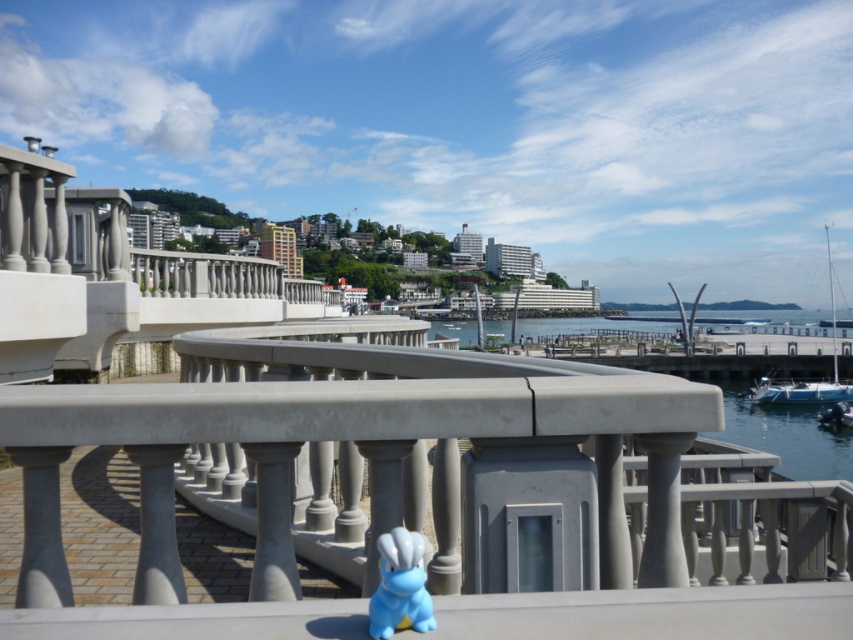
Question: Which object is the closest to the clear water at center?

Choices:
 (A) blue rubber duck at center
 (B) white glossy boat at right
 (C) blue plastic boat at lower right

Answer: (A)

Question: Is clear water at center closer to camera compared to blue rubber duck at center?

Choices:
 (A) yes
 (B) no

Answer: (B)

Question: Which of the following is the farthest from the observer?

Choices:
 (A) (492, 324)
 (B) (834, 387)
 (C) (378, 595)
 (D) (840, 388)

Answer: (A)

Question: Which point is farther from the camera taking this photo?

Choices:
 (A) (393, 572)
 (B) (764, 387)
 (C) (805, 387)
 (D) (786, 452)

Answer: (B)

Question: Is clear water at center above white glossy boat at right?

Choices:
 (A) no
 (B) yes

Answer: (A)

Question: Can you confirm if white glossy boat at right is positioned below blue plastic boat at lower right?

Choices:
 (A) no
 (B) yes

Answer: (A)